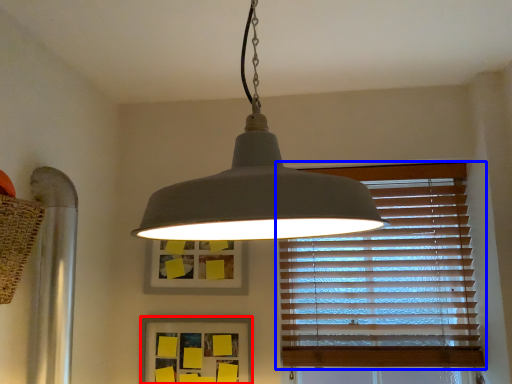
Question: Which of the following is the farthest to the observer, picture frame (highlighted by a red box) or window blind (highlighted by a blue box)?

Choices:
 (A) picture frame
 (B) window blind

Answer: (B)